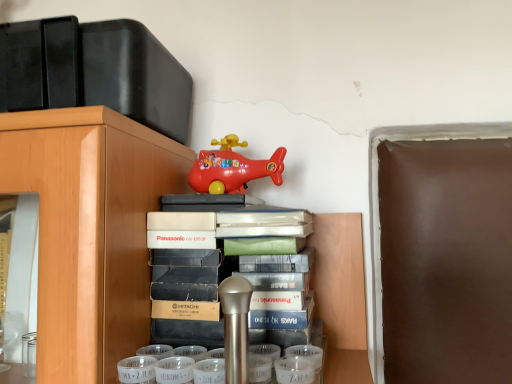
Question: From the image's perspective, does white matte book at center appear higher than matte plastic toy airplane at upper center?

Choices:
 (A) yes
 (B) no

Answer: (B)

Question: Does white matte book at center have a greater height compared to matte plastic toy airplane at upper center?

Choices:
 (A) yes
 (B) no

Answer: (A)

Question: Does white matte book at center have a lesser height compared to matte plastic toy airplane at upper center?

Choices:
 (A) no
 (B) yes

Answer: (A)

Question: Is matte plastic toy airplane at upper center inside white matte book at center?

Choices:
 (A) no
 (B) yes

Answer: (A)

Question: From a real-world perspective, is white matte book at center below matte plastic toy airplane at upper center?

Choices:
 (A) yes
 (B) no

Answer: (A)

Question: Is white matte book at center wider than matte plastic toy airplane at upper center?

Choices:
 (A) no
 (B) yes

Answer: (B)

Question: Could you tell me if matte plastic toy airplane at upper center is facing white matte book at center?

Choices:
 (A) no
 (B) yes

Answer: (A)

Question: Is the depth of matte plastic toy airplane at upper center less than that of white matte book at center?

Choices:
 (A) no
 (B) yes

Answer: (A)

Question: Is matte plastic toy airplane at upper center oriented away from white matte book at center?

Choices:
 (A) yes
 (B) no

Answer: (B)

Question: From the image's perspective, is matte plastic toy airplane at upper center over white matte book at center?

Choices:
 (A) yes
 (B) no

Answer: (A)

Question: Is matte plastic toy airplane at upper center surrounding white matte book at center?

Choices:
 (A) yes
 (B) no

Answer: (B)

Question: Considering the relative sizes of matte plastic toy airplane at upper center and white matte book at center in the image provided, is matte plastic toy airplane at upper center thinner than white matte book at center?

Choices:
 (A) yes
 (B) no

Answer: (A)

Question: Is point (279, 344) positioned closer to the camera than point (207, 157)?

Choices:
 (A) closer
 (B) farther

Answer: (A)